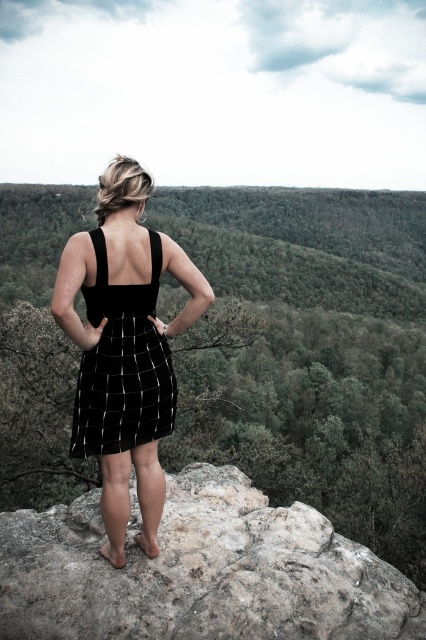
You are a photographer aiming to capture the black woven dress at center and the green leafy hillside at upper center in the same frame. Based on their positions, which object should you adjust your camera to focus on first to ensure both are in the frame?

The green leafy hillside at upper center is to the right of the black woven dress at center, so you should focus on the black woven dress at center first to ensure both are included in the frame.

You are a fashion designer observing the scene. You notice two dresses at the center of the image. Can you determine if there is enough space between the black woven dress at center and the black velvet dress at center to fit a standard mannequin that requires 60 centimeters of space?

The black woven dress at center and black velvet dress at center are 66.92 centimeters apart, which is more than the required 60 centimeters. Therefore, there is sufficient space to fit a standard mannequin between them.